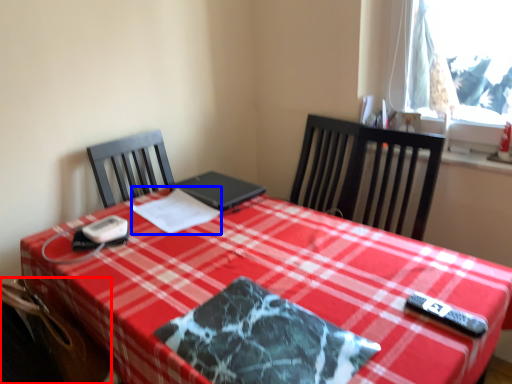
Question: Which object appears closest to the camera in this image, swivel chair (highlighted by a red box) or linen (highlighted by a blue box)?

Choices:
 (A) swivel chair
 (B) linen

Answer: (A)